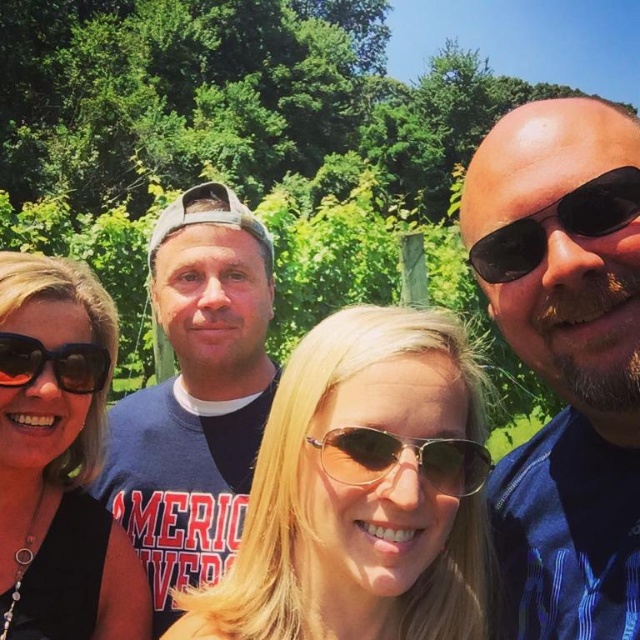
In the scene shown: Is blue striped shirt at center shorter than blonde hair at center?

No, blue striped shirt at center is not shorter than blonde hair at center.

Which is more to the right, blue striped shirt at center or blonde hair at center?

blue striped shirt at center is more to the right.

Who is more forward, [561,516] or [426,572]?

Positioned in front is point [426,572].

The width and height of the screenshot is (640, 640). I want to click on blue striped shirt at center, so click(564, 358).

Is blonde hair at center positioned behind blue cotton t-shirt at center?

No, blonde hair at center is closer to the viewer.

Between blonde hair at center and blue cotton t-shirt at center, which one has less height?

With less height is blonde hair at center.

Find the location of a particular element. The width and height of the screenshot is (640, 640). blonde hair at center is located at coordinates pos(362,492).

Measure the distance from black matte sunglasses at upper left to black plastic sunglasses at right.

A distance of 32.23 inches exists between black matte sunglasses at upper left and black plastic sunglasses at right.

Is point (112, 634) farther from camera compared to point (513, 252)?

Yes, it is behind point (513, 252).

Image resolution: width=640 pixels, height=640 pixels. What do you see at coordinates (49, 396) in the screenshot? I see `black matte sunglasses at upper left` at bounding box center [49, 396].

Identify the location of black matte sunglasses at upper left. pyautogui.click(x=49, y=396).